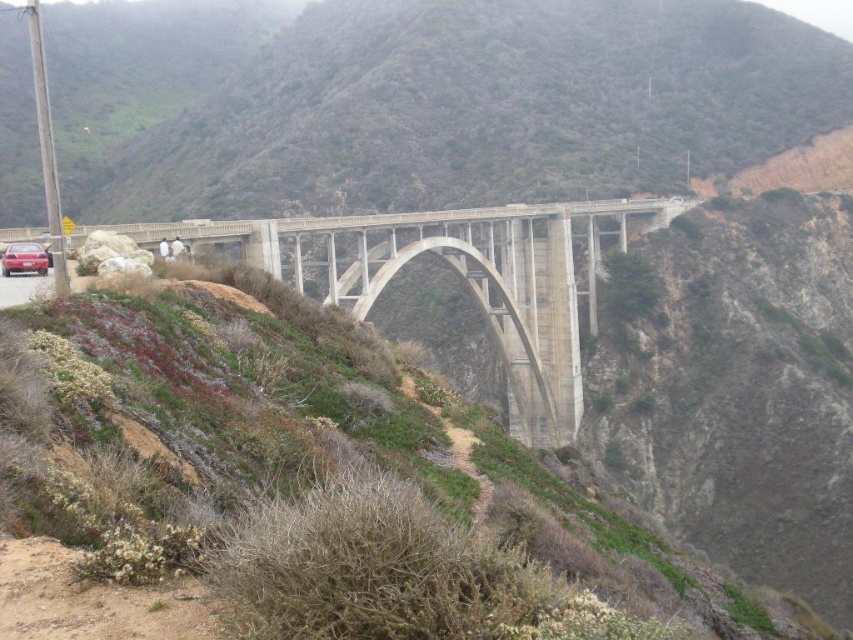
In the scene shown: Does concrete bridge at center come behind matte red car at lower left?

Yes, concrete bridge at center is further from the viewer.

Between concrete bridge at center and matte red car at lower left, which one appears on the right side from the viewer's perspective?

concrete bridge at center is more to the right.

Does point (527, 362) come in front of point (30, 285)?

No, (527, 362) is further to viewer.

At what (x,y) coordinates should I click in order to perform the action: click on concrete bridge at center. Please return your answer as a coordinate pair (x, y). This screenshot has width=853, height=640. Looking at the image, I should click on (459, 276).

Does concrete bridge at center have a smaller size compared to shiny red sedan at lower left?

Actually, concrete bridge at center might be larger than shiny red sedan at lower left.

Between point (434, 220) and point (9, 260), which one is positioned in front?

Point (9, 260)

What do you see at coordinates (459, 276) in the screenshot? I see `concrete bridge at center` at bounding box center [459, 276].

Identify the location of concrete bridge at center. Image resolution: width=853 pixels, height=640 pixels. (459, 276).

Between point (27, 298) and point (28, 268), which one is positioned in front?

Point (27, 298) is more forward.

Measure the distance between matte red car at lower left and shiny red sedan at lower left.

The distance of matte red car at lower left from shiny red sedan at lower left is 8.30 feet.

The height and width of the screenshot is (640, 853). What are the coordinates of `matte red car at lower left` in the screenshot? It's located at (24, 288).

Where is `matte red car at lower left`? Image resolution: width=853 pixels, height=640 pixels. matte red car at lower left is located at coordinates (24, 288).